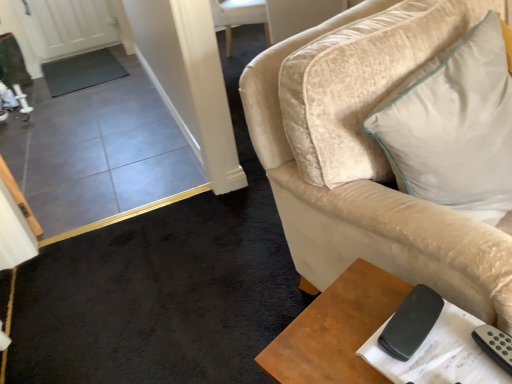
Question: Does black matte remote at lower right have a greater width compared to brown wooden table at lower right?

Choices:
 (A) no
 (B) yes

Answer: (A)

Question: Is black matte remote at lower right further to the viewer compared to brown wooden table at lower right?

Choices:
 (A) yes
 (B) no

Answer: (A)

Question: Is brown wooden table at lower right at the back of black matte remote at lower right?

Choices:
 (A) no
 (B) yes

Answer: (A)

Question: From a real-world perspective, is black matte remote at lower right over brown wooden table at lower right?

Choices:
 (A) yes
 (B) no

Answer: (A)

Question: Is black matte remote at lower right to the left of brown wooden table at lower right from the viewer's perspective?

Choices:
 (A) no
 (B) yes

Answer: (A)

Question: Does black matte remote at lower right contain brown wooden table at lower right?

Choices:
 (A) yes
 (B) no

Answer: (B)

Question: Is white soft cushion at upper right far away from brown wooden table at lower right?

Choices:
 (A) yes
 (B) no

Answer: (B)

Question: Is white soft cushion at upper right outside brown wooden table at lower right?

Choices:
 (A) yes
 (B) no

Answer: (A)

Question: From the image's perspective, does white soft cushion at upper right appear lower than brown wooden table at lower right?

Choices:
 (A) no
 (B) yes

Answer: (A)

Question: Can you confirm if white soft cushion at upper right is shorter than brown wooden table at lower right?

Choices:
 (A) yes
 (B) no

Answer: (A)

Question: Does white soft cushion at upper right have a greater height compared to brown wooden table at lower right?

Choices:
 (A) no
 (B) yes

Answer: (A)

Question: Is white soft cushion at upper right smaller than brown wooden table at lower right?

Choices:
 (A) no
 (B) yes

Answer: (A)

Question: From the image's perspective, is black matte remote at lower right over white soft cushion at upper right?

Choices:
 (A) yes
 (B) no

Answer: (B)